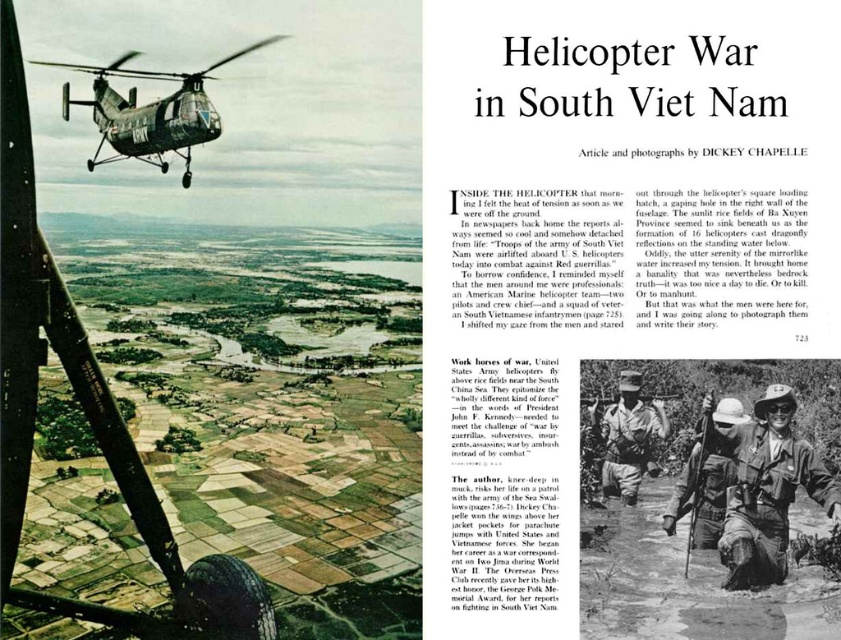
Based on the photo, is camouflage fabric helmet at lower right wider than camouflage fabric helmet at center?

Yes.

Between camouflage fabric helmet at lower right and camouflage fabric helmet at center, which one appears on the right side from the viewer's perspective?

camouflage fabric helmet at lower right is more to the right.

Between point (775, 460) and point (678, 515), which one is positioned in front?

Point (775, 460) is in front.

Where is `camouflage fabric helmet at lower right`? camouflage fabric helmet at lower right is located at coordinates (767, 490).

Which is more to the left, green camouflage helicopter at upper left or camouflage fabric uniform at center?

From the viewer's perspective, green camouflage helicopter at upper left appears more on the left side.

Is green camouflage helicopter at upper left thinner than camouflage fabric uniform at center?

No, green camouflage helicopter at upper left is not thinner than camouflage fabric uniform at center.

Is point (144, 72) closer to camera compared to point (654, 420)?

No, (144, 72) is behind (654, 420).

Where is `green camouflage helicopter at upper left`? Image resolution: width=841 pixels, height=640 pixels. green camouflage helicopter at upper left is located at coordinates pyautogui.click(x=151, y=113).

Does camouflage fabric helmet at lower right appear under green camouflage helicopter at upper left?

Yes, camouflage fabric helmet at lower right is below green camouflage helicopter at upper left.

What do you see at coordinates (767, 490) in the screenshot? I see `camouflage fabric helmet at lower right` at bounding box center [767, 490].

The height and width of the screenshot is (640, 841). Find the location of `camouflage fabric helmet at lower right`. camouflage fabric helmet at lower right is located at coordinates (767, 490).